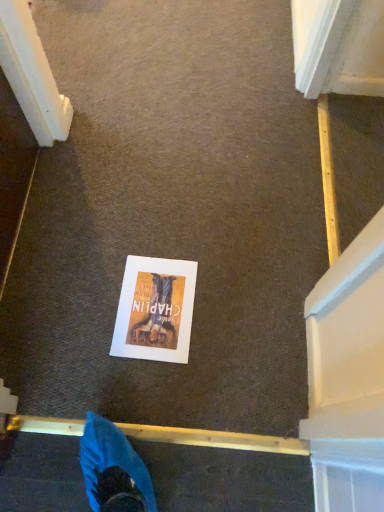
Identify the location of empty space that is ontop of white paper at center (from a real-world perspective). (153, 308).